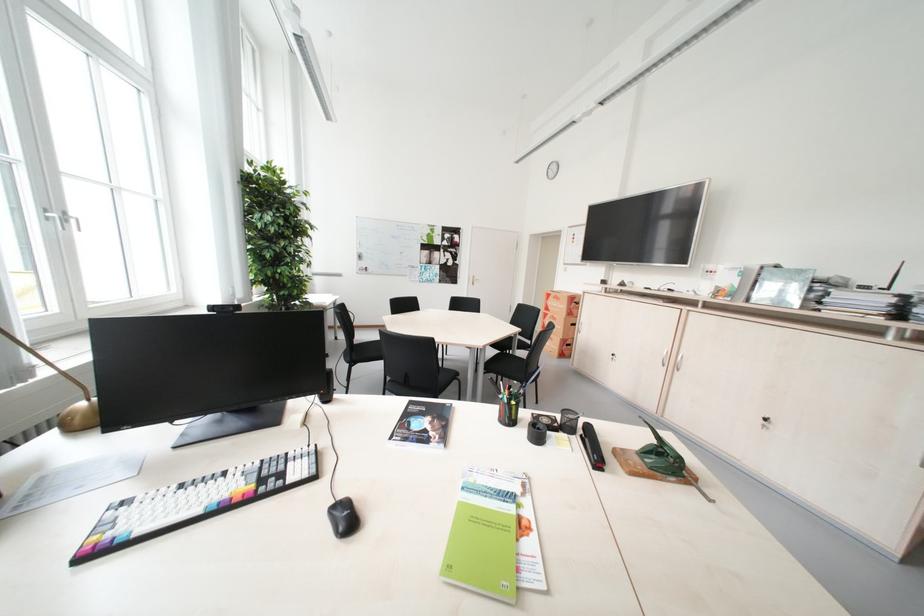
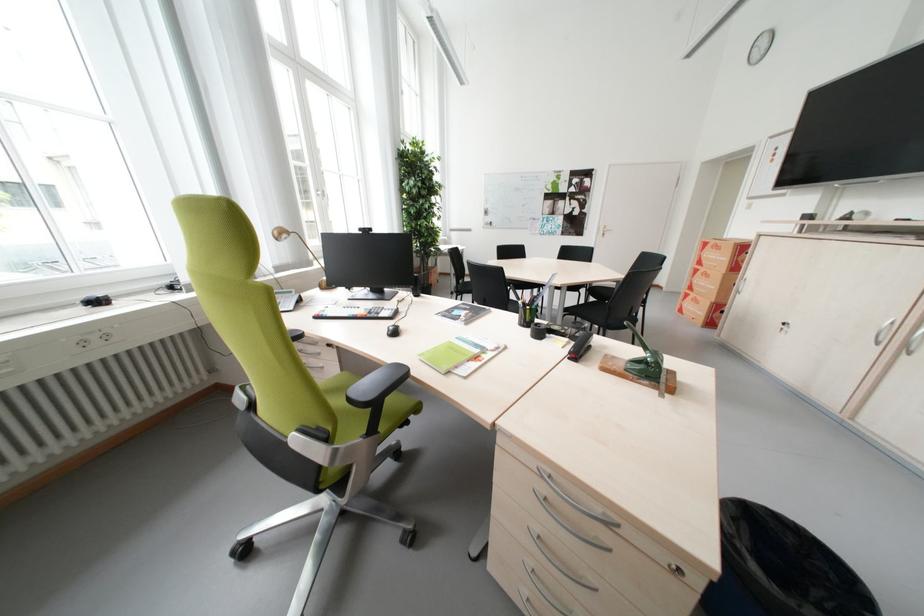
Find the pixel in the second image that matches (451,575) in the first image.

(429, 357)